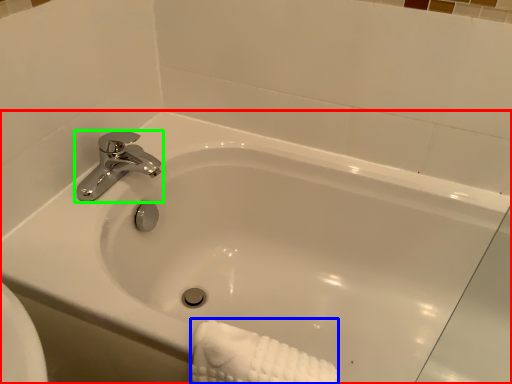
Question: Estimate the real-world distances between objects in this image. Which object is closer to bathtub (highlighted by a red box), bath towel (highlighted by a blue box) or tap (highlighted by a green box)?

Choices:
 (A) bath towel
 (B) tap

Answer: (B)